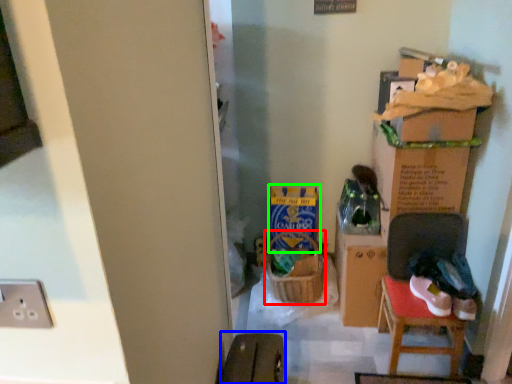
Question: Which object is the farthest from laundry basket (highlighted by a red box)? Choose among these: armchair (highlighted by a blue box) or cardboard box (highlighted by a green box).

Choices:
 (A) armchair
 (B) cardboard box

Answer: (A)